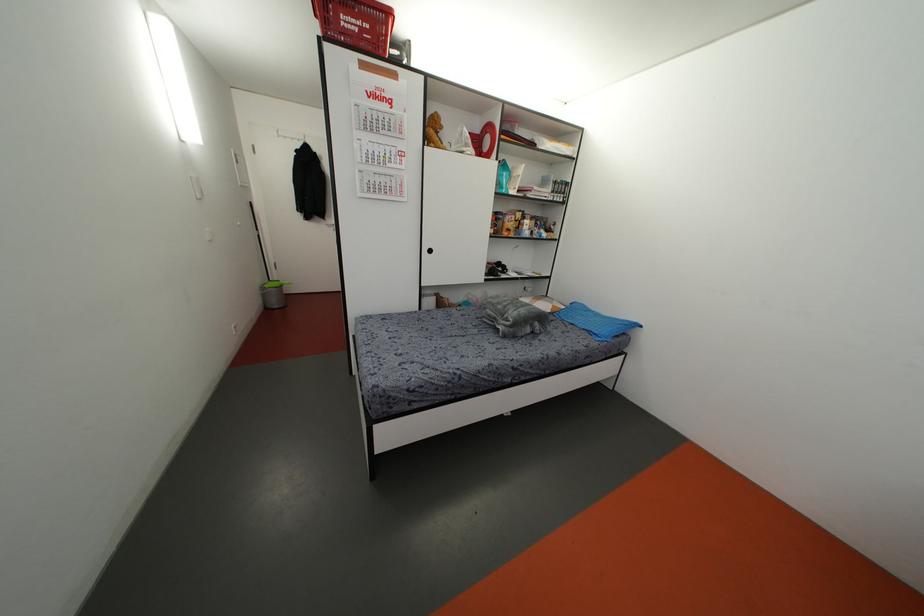
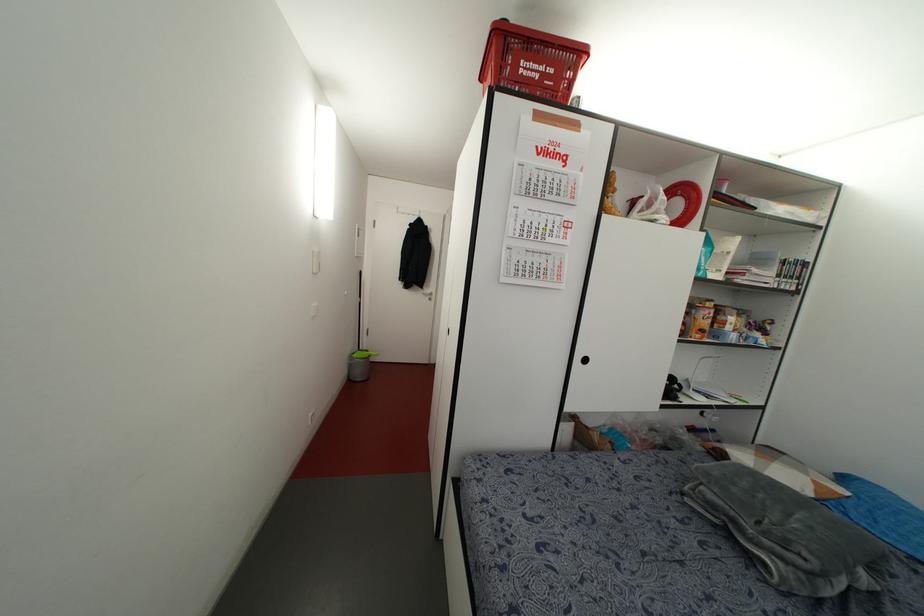
Question: The images are taken continuously from a first-person perspective. In which direction is your viewpoint rotating?

Choices:
 (A) Left
 (B) Right
 (C) Up
 (D) Down

Answer: (A)